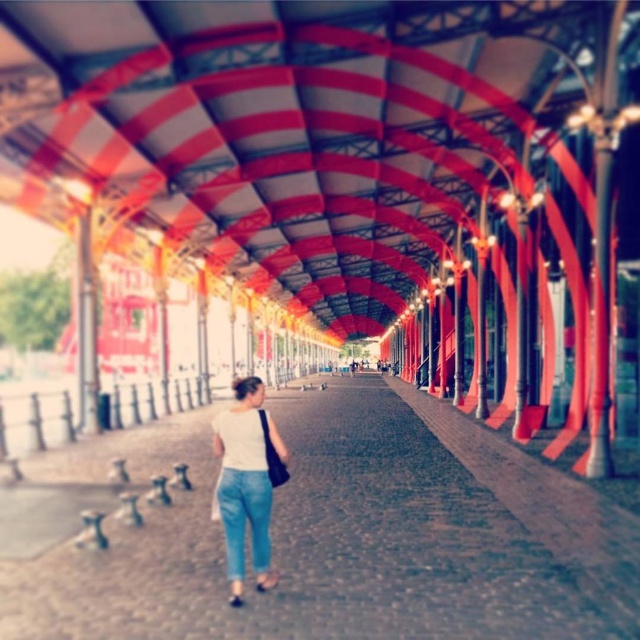
Question: Can you confirm if white matte shirt at center is positioned below blue denim jeans at center?

Choices:
 (A) yes
 (B) no

Answer: (B)

Question: Which object is farther from the camera taking this photo?

Choices:
 (A) brown cobblestone pavement at center
 (B) blue denim jeans at center

Answer: (B)

Question: Can you confirm if brown cobblestone pavement at center is positioned above white matte shirt at center?

Choices:
 (A) no
 (B) yes

Answer: (A)

Question: Which object appears farthest from the camera in this image?

Choices:
 (A) white matte shirt at center
 (B) brown cobblestone pavement at center

Answer: (A)

Question: Does brown cobblestone pavement at center appear on the left side of white matte shirt at center?

Choices:
 (A) no
 (B) yes

Answer: (A)

Question: Which of the following is the closest to the observer?

Choices:
 (A) (241, 577)
 (B) (449, 577)

Answer: (A)